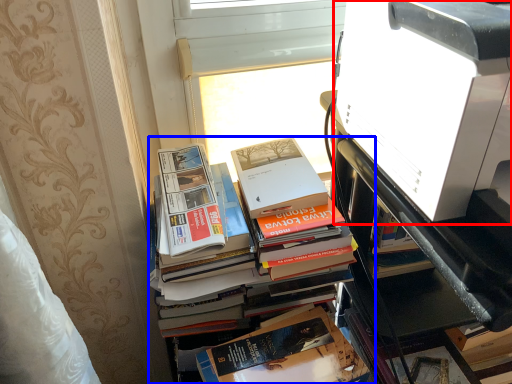
Question: Among these objects, which one is farthest to the camera, printer (highlighted by a red box) or book (highlighted by a blue box)?

Choices:
 (A) printer
 (B) book

Answer: (B)